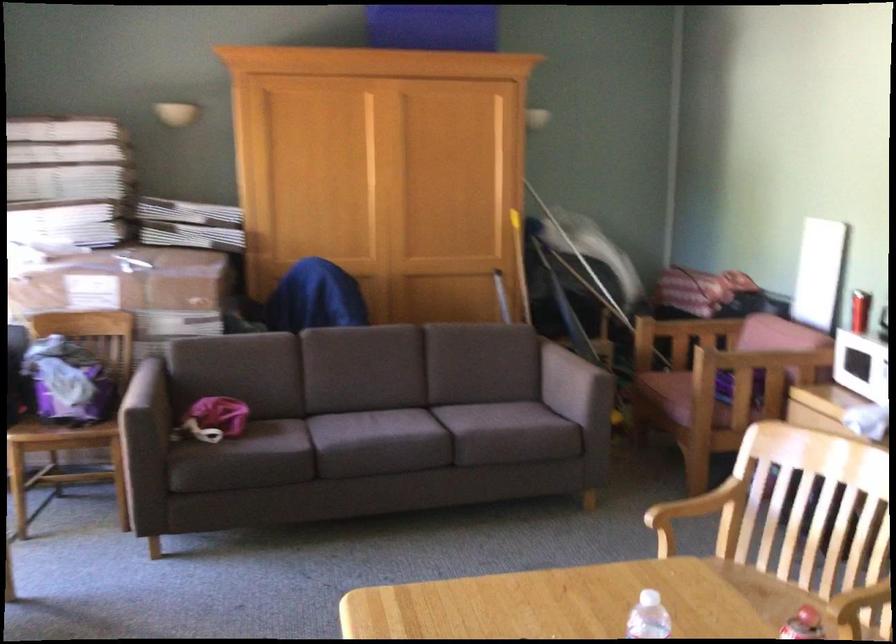
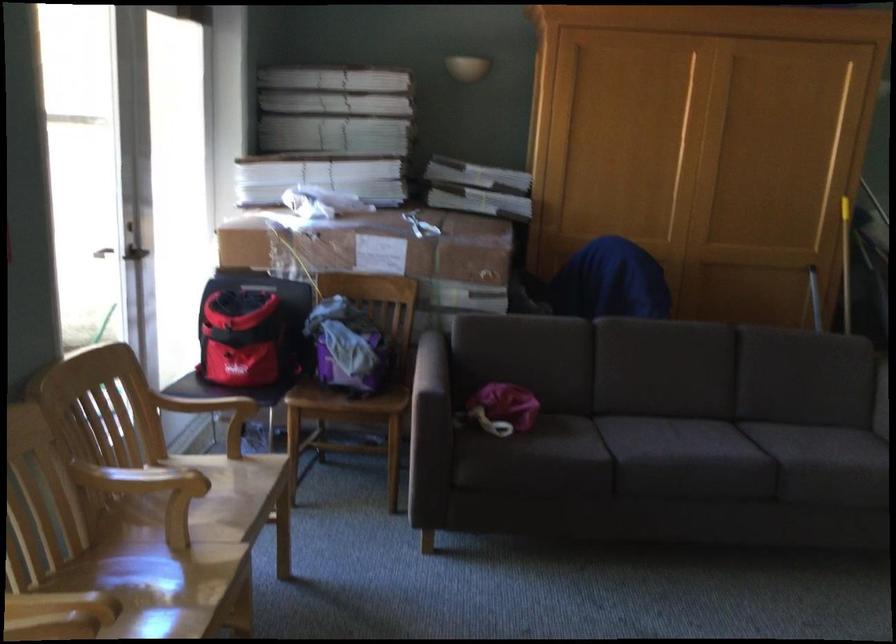
The point at (88, 289) is marked in the first image. Where is the corresponding point in the second image?

(371, 245)